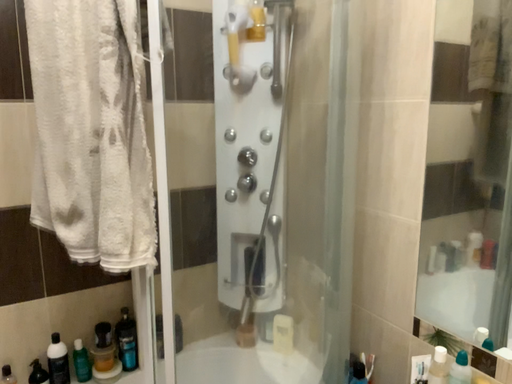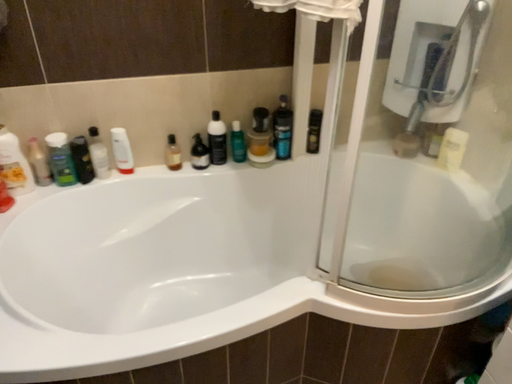
Question: Which way did the camera rotate in the video?

Choices:
 (A) rotated right
 (B) rotated left

Answer: (B)